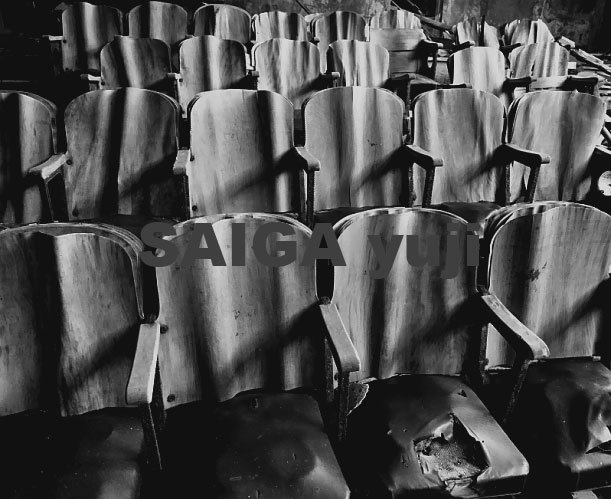
Image resolution: width=611 pixels, height=499 pixels. I want to click on chair seat, so click(x=76, y=475), click(x=260, y=447), click(x=395, y=437), click(x=547, y=417), click(x=470, y=217), click(x=329, y=214), click(x=115, y=220).